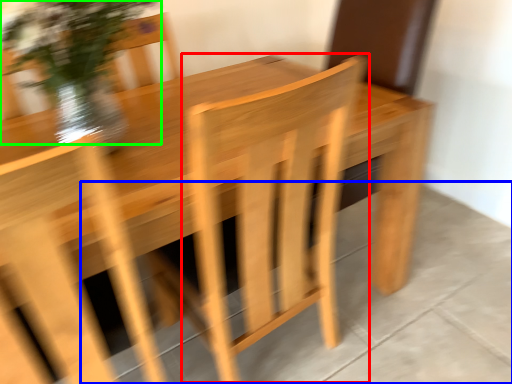
Question: Which object is the closest to the armchair (highlighted by a red box)? Choose among these: concrete (highlighted by a blue box) or floral arrangement (highlighted by a green box).

Choices:
 (A) concrete
 (B) floral arrangement

Answer: (A)